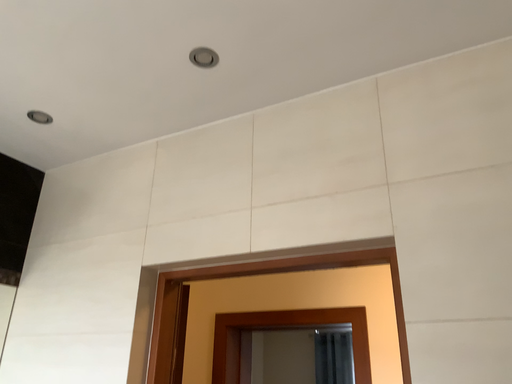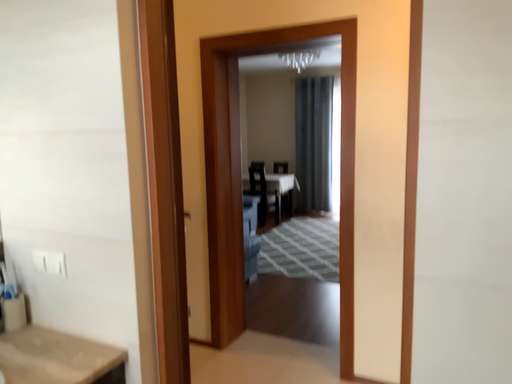
Question: How did the camera likely rotate when shooting the video?

Choices:
 (A) rotated upward
 (B) rotated downward

Answer: (B)